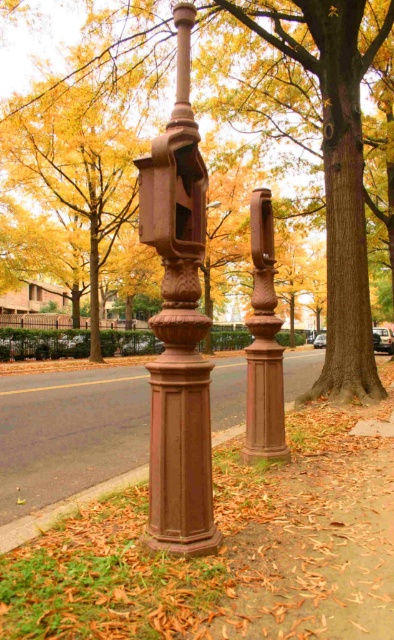
Question: Is brown polished pillar at center below brown cast iron at lower center?

Choices:
 (A) yes
 (B) no

Answer: (B)

Question: Is rusty metal pillar at center to the left of brown wood tree at center from the viewer's perspective?

Choices:
 (A) no
 (B) yes

Answer: (A)

Question: Which object appears farthest from the camera in this image?

Choices:
 (A) brown polished stone post at center
 (B) brown polished pillar at center
 (C) rusty metal pillar at center

Answer: (B)

Question: Based on their relative distances, which object is nearer to the brown polished stone post at center?

Choices:
 (A) brown cast iron at lower center
 (B) brown polished pillar at center

Answer: (A)

Question: Can you confirm if rusty metal pillar at center is positioned above brown polished stone post at center?

Choices:
 (A) yes
 (B) no

Answer: (A)

Question: Estimate the real-world distances between objects in this image. Which object is closer to the brown wood tree at center?

Choices:
 (A) brown polished stone post at center
 (B) brown polished pillar at center

Answer: (A)